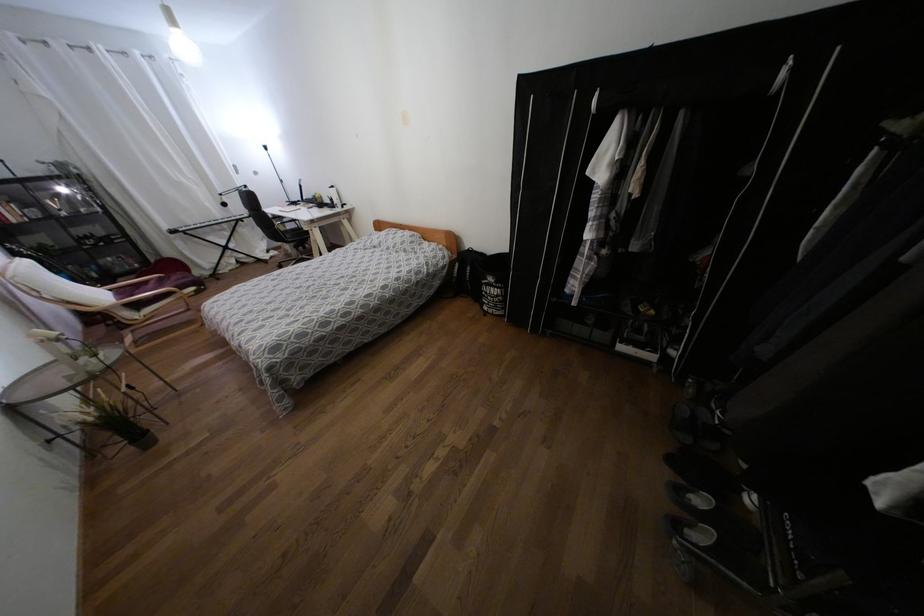
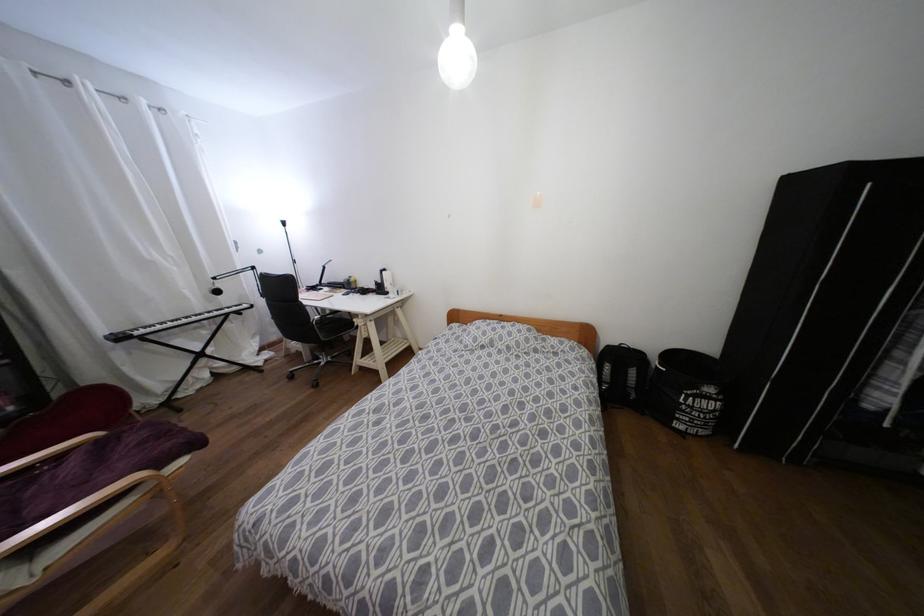
The images are taken continuously from a first-person perspective. In which direction are you moving?

The cameraman walked toward left, forward.